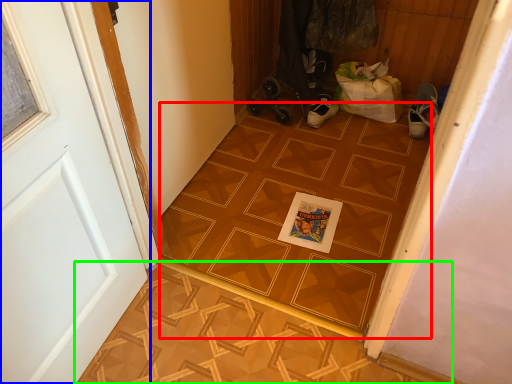
Question: Considering the real-world distances, which object is farthest from ceramic tile (highlighted by a red box)? door (highlighted by a blue box) or tile (highlighted by a green box)?

Choices:
 (A) door
 (B) tile

Answer: (A)